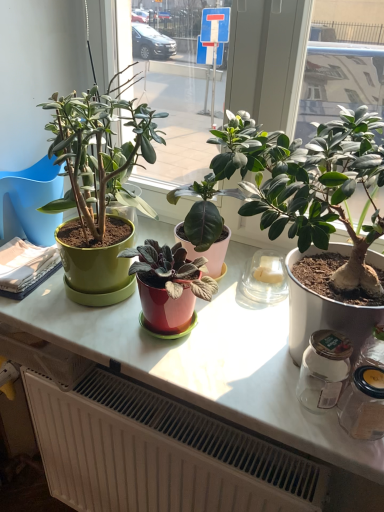
The height and width of the screenshot is (512, 384). I want to click on green matte plant pot at left, marked as the 2th houseplant in a right-to-left arrangement, so click(x=99, y=190).

At what (x,y) coordinates should I click in order to perform the action: click on matte green plant at center, the 1th houseplant viewed from the right. Please return your answer as a coordinate pair (x, y). Looking at the image, I should click on (325, 192).

Does matte green pot at left have a greater height compared to matte green plant at center, arranged as the second houseplant when viewed from the left?

Incorrect, the height of matte green pot at left is not larger of that of matte green plant at center, arranged as the second houseplant when viewed from the left.

Is matte green pot at left not close to matte green plant at center, the 1th houseplant viewed from the right?

matte green pot at left is near matte green plant at center, the 1th houseplant viewed from the right, not far away.

Which object is wider, matte green pot at left or matte green plant at center, the 1th houseplant viewed from the right?

matte green pot at left.

Is matte green plant at center, the 1th houseplant viewed from the right, wider than white matte radiator at lower center?

Yes.

From the image's perspective, which object appears higher, matte green plant at center, the 1th houseplant viewed from the right, or white matte radiator at lower center?

matte green plant at center, the 1th houseplant viewed from the right, appears higher in the image.

Can you confirm if matte green plant at center, arranged as the second houseplant when viewed from the left, is shorter than green matte plant pot at left, marked as the 2th houseplant in a right-to-left arrangement?

In fact, matte green plant at center, arranged as the second houseplant when viewed from the left, may be taller than green matte plant pot at left, marked as the 2th houseplant in a right-to-left arrangement.

Are matte green plant at center, the 1th houseplant viewed from the right, and green matte plant pot at left, which is counted as the 1th houseplant, starting from the left, far apart?

No, matte green plant at center, the 1th houseplant viewed from the right, is not far from green matte plant pot at left, which is counted as the 1th houseplant, starting from the left.

Could you tell me if matte green plant at center, the 1th houseplant viewed from the right, is facing green matte plant pot at left, which is counted as the 1th houseplant, starting from the left?

No.

How much distance is there between matte green plant at center, arranged as the second houseplant when viewed from the left, and green matte plant pot at left, which is counted as the 1th houseplant, starting from the left?

15.41 inches.

Consider the image. Is white matte radiator at lower center placed right next to green matte plant pot at left, which is counted as the 1th houseplant, starting from the left?

white matte radiator at lower center is not next to green matte plant pot at left, which is counted as the 1th houseplant, starting from the left, and they're not touching.

Between white matte radiator at lower center and green matte plant pot at left, marked as the 2th houseplant in a right-to-left arrangement, which one appears on the right side from the viewer's perspective?

Positioned to the right is white matte radiator at lower center.

In the scene shown: Could you tell me if white matte radiator at lower center is facing green matte plant pot at left, marked as the 2th houseplant in a right-to-left arrangement?

No, white matte radiator at lower center is not facing towards green matte plant pot at left, marked as the 2th houseplant in a right-to-left arrangement.

From the image's perspective, which is above, white matte radiator at lower center or green matte plant pot at left, marked as the 2th houseplant in a right-to-left arrangement?

From the image's view, green matte plant pot at left, marked as the 2th houseplant in a right-to-left arrangement, is above.

Considering the relative positions of matte green pot at left and white matte radiator at lower center in the image provided, is matte green pot at left to the left or to the right of white matte radiator at lower center?

Based on their positions, matte green pot at left is located to the left of white matte radiator at lower center.

Is matte green pot at left aimed at white matte radiator at lower center?

No.

Is matte green pot at left inside or outside of white matte radiator at lower center?

matte green pot at left is outside white matte radiator at lower center.

Based on the photo, is the surface of matte green pot at left in direct contact with white matte radiator at lower center?

No, matte green pot at left is not with white matte radiator at lower center.

Does green matte plant pot at left, marked as the 2th houseplant in a right-to-left arrangement, turn towards matte green plant at center, arranged as the second houseplant when viewed from the left?

No, green matte plant pot at left, marked as the 2th houseplant in a right-to-left arrangement, is not turned towards matte green plant at center, arranged as the second houseplant when viewed from the left.

Considering the sizes of objects green matte plant pot at left, marked as the 2th houseplant in a right-to-left arrangement, and matte green plant at center, the 1th houseplant viewed from the right, in the image provided, who is bigger, green matte plant pot at left, marked as the 2th houseplant in a right-to-left arrangement, or matte green plant at center, the 1th houseplant viewed from the right,?

Bigger between the two is green matte plant pot at left, marked as the 2th houseplant in a right-to-left arrangement.

Would you consider green matte plant pot at left, marked as the 2th houseplant in a right-to-left arrangement, to be distant from matte green plant at center, the 1th houseplant viewed from the right?

No, green matte plant pot at left, marked as the 2th houseplant in a right-to-left arrangement, is in close proximity to matte green plant at center, the 1th houseplant viewed from the right.

Is green matte plant pot at left, which is counted as the 1th houseplant, starting from the left, situated inside matte green plant at center, the 1th houseplant viewed from the right, or outside?

The correct answer is: outside.

Considering the relative sizes of white matte radiator at lower center and matte green pot at left in the image provided, is white matte radiator at lower center thinner than matte green pot at left?

Indeed, white matte radiator at lower center has a lesser width compared to matte green pot at left.

Between point (143, 393) and point (49, 195), which one is positioned in front?

Positioned in front is point (143, 393).

Consider the image. Is white matte radiator at lower center at the right side of matte green pot at left?

Yes.

How distant is white matte radiator at lower center from matte green pot at left?

They are 23.09 inches apart.

Where is `chair above the matte green plant at center, the 1th houseplant viewed from the right (from the image's perspective)`? This screenshot has height=512, width=384. chair above the matte green plant at center, the 1th houseplant viewed from the right (from the image's perspective) is located at coordinates [31, 202].

You are a GUI agent. You are given a task and a screenshot of the screen. Output one action in this format:
    pyautogui.click(x=<x>, y=<y>)
    Task: Click on the radiator below the matte green plant at center, the 1th houseplant viewed from the right (from a real-world perspective)
    
    Given the screenshot: What is the action you would take?
    pyautogui.click(x=159, y=453)

Estimate the real-world distances between objects in this image. Which object is further from matte green plant at center, the 1th houseplant viewed from the right, white matte radiator at lower center or green matte plant pot at left, which is counted as the 1th houseplant, starting from the left?

Among the two, white matte radiator at lower center is located further to matte green plant at center, the 1th houseplant viewed from the right.

Based on their spatial positions, is green matte plant pot at left, which is counted as the 1th houseplant, starting from the left, or matte green plant at center, arranged as the second houseplant when viewed from the left, further from matte green pot at left?

matte green plant at center, arranged as the second houseplant when viewed from the left, lies further to matte green pot at left than the other object.

When comparing their distances from white matte radiator at lower center, does matte green pot at left or matte green plant at center, arranged as the second houseplant when viewed from the left, seem further?

Among the two, matte green pot at left is located further to white matte radiator at lower center.

Looking at the image, which one is located further to matte green plant at center, arranged as the second houseplant when viewed from the left, matte green pot at left or green matte plant pot at left, marked as the 2th houseplant in a right-to-left arrangement?

matte green pot at left lies further to matte green plant at center, arranged as the second houseplant when viewed from the left, than the other object.

Considering their positions, is matte green pot at left positioned further to green matte plant pot at left, which is counted as the 1th houseplant, starting from the left, than white matte radiator at lower center?

white matte radiator at lower center is positioned further to the anchor green matte plant pot at left, which is counted as the 1th houseplant, starting from the left.

Considering their positions, is white matte radiator at lower center positioned closer to matte green pot at left than matte green plant at center, arranged as the second houseplant when viewed from the left?

white matte radiator at lower center.

Looking at the image, which one is located closer to green matte plant pot at left, marked as the 2th houseplant in a right-to-left arrangement, matte green plant at center, arranged as the second houseplant when viewed from the left, or white matte radiator at lower center?

Based on the image, matte green plant at center, arranged as the second houseplant when viewed from the left, appears to be nearer to green matte plant pot at left, marked as the 2th houseplant in a right-to-left arrangement.

When comparing their distances from matte green pot at left, does white matte radiator at lower center or green matte plant pot at left, which is counted as the 1th houseplant, starting from the left, seem further?

white matte radiator at lower center is positioned further to the anchor matte green pot at left.

Locate an element on the screen. chair that lies between green matte plant pot at left, which is counted as the 1th houseplant, starting from the left, and white matte radiator at lower center from top to bottom is located at coordinates (31, 202).

This screenshot has height=512, width=384. In order to click on houseplant between matte green pot at left and white matte radiator at lower center vertically in this screenshot , I will do `click(325, 192)`.

Identify the location of houseplant located between matte green pot at left and matte green plant at center, arranged as the second houseplant when viewed from the left, in the left-right direction. click(99, 190).

Where is `houseplant between green matte plant pot at left, which is counted as the 1th houseplant, starting from the left, and white matte radiator at lower center in the up-down direction`? houseplant between green matte plant pot at left, which is counted as the 1th houseplant, starting from the left, and white matte radiator at lower center in the up-down direction is located at coordinates (325, 192).